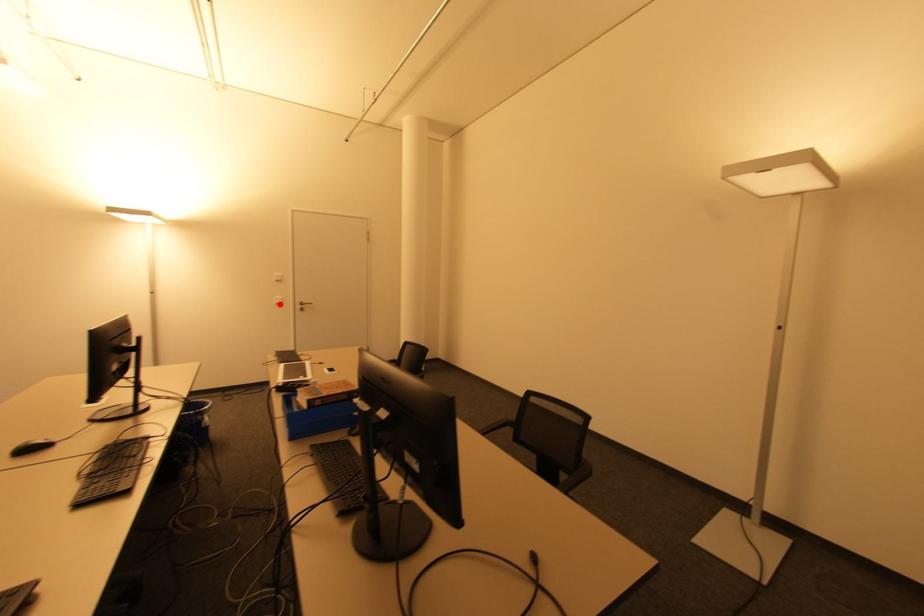
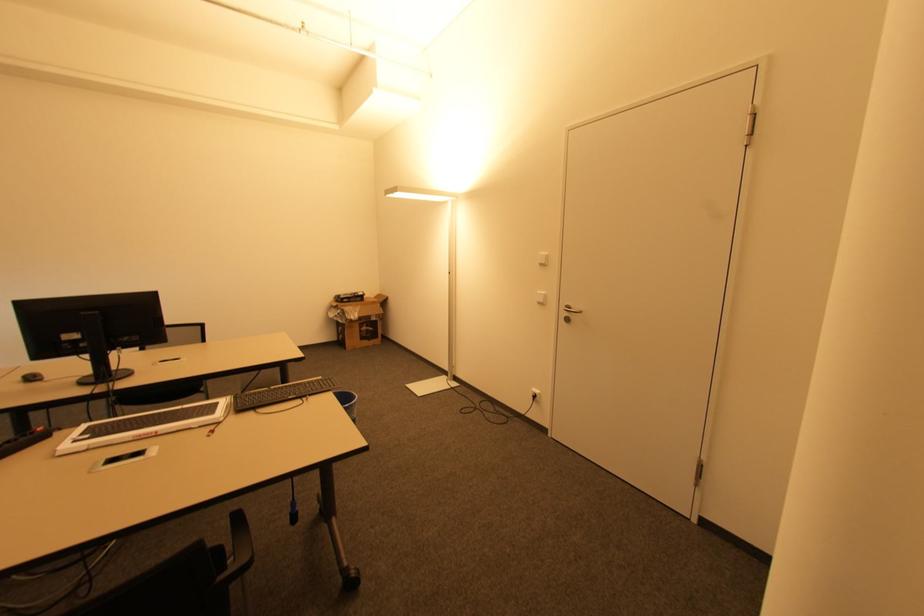
Locate, in the second image, the point that corresponds to the highlighted location in the first image.

(541, 302)